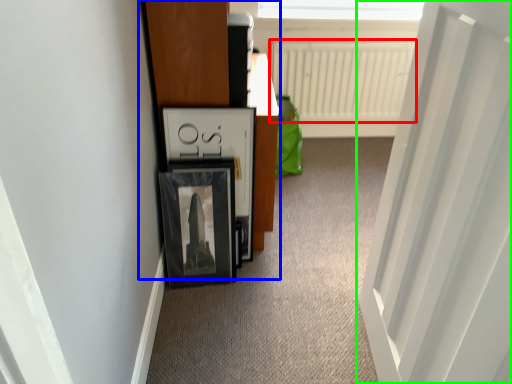
Question: Which is nearer to the radiator (highlighted by a red box)? dresser (highlighted by a blue box) or door (highlighted by a green box).

Choices:
 (A) dresser
 (B) door

Answer: (A)